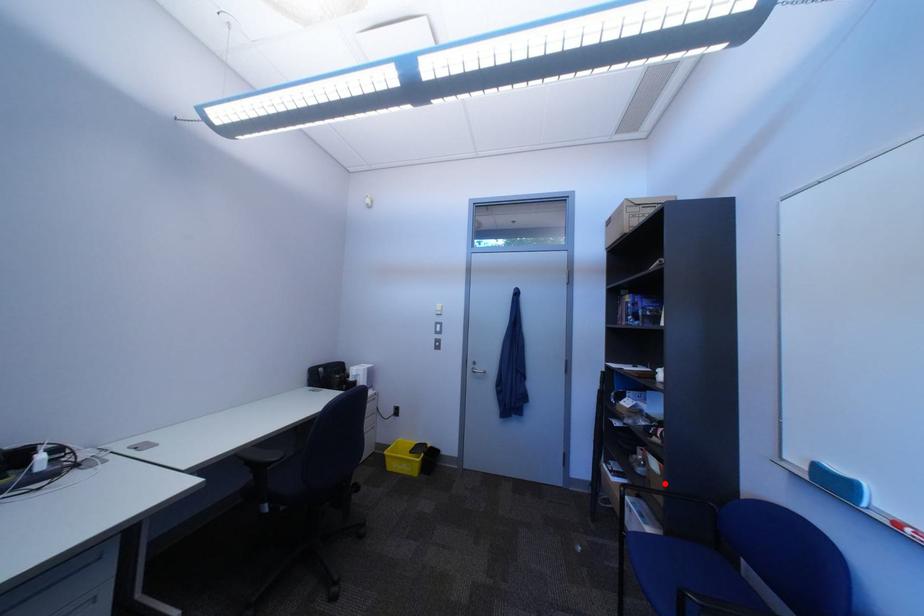
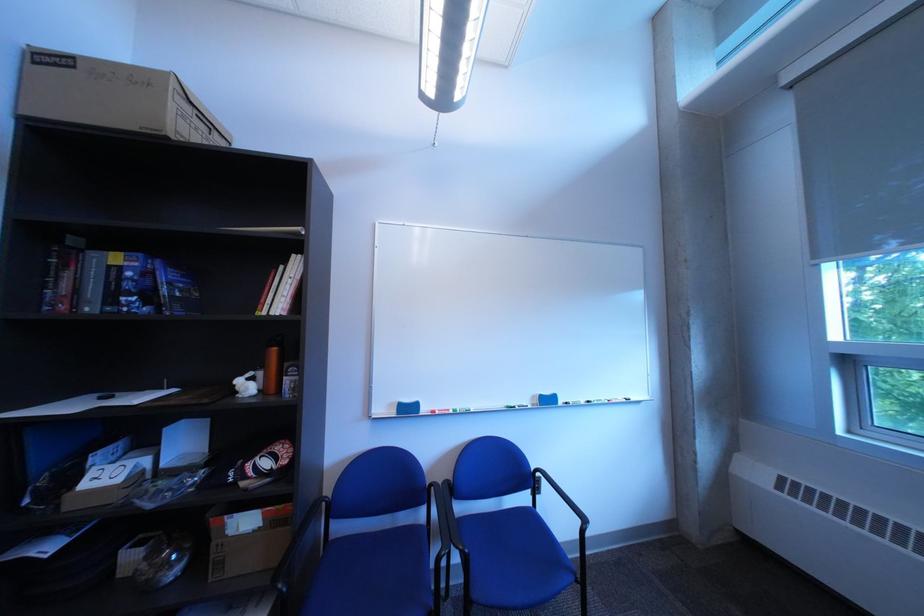
Locate, in the second image, the point that corresponds to the highlighted location in the first image.

(237, 565)